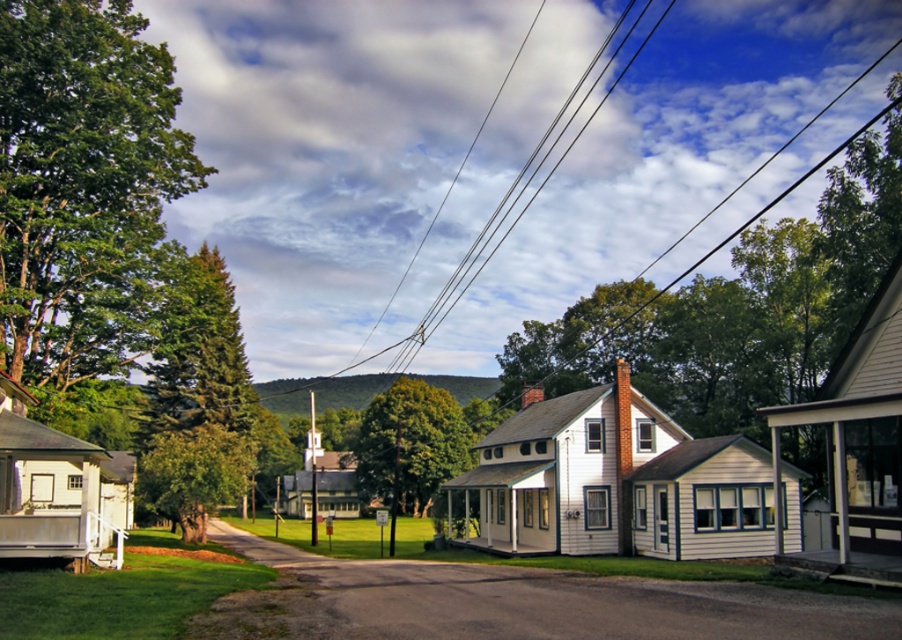
Is point (587, 109) positioned before point (227, 467)?

No, it is behind (227, 467).

Who is positioned more to the right, black wire at upper center or green leafy tree at center?

Positioned to the right is black wire at upper center.

Is point (656, 12) farther from camera compared to point (141, 493)?

Yes.

Identify the location of black wire at upper center. The width and height of the screenshot is (902, 640). (526, 179).

Does green leafy tree at left have a greater height compared to smooth asphalt driveway at center?

Yes.

Looking at this image, does green leafy tree at left appear over smooth asphalt driveway at center?

Correct, green leafy tree at left is located above smooth asphalt driveway at center.

Is point (98, 300) positioned behind point (219, 625)?

Yes, it is behind point (219, 625).

In order to click on green leafy tree at left in this screenshot , I will do `click(83, 188)`.

Is point (319, 557) farther from viewer compared to point (183, 448)?

No, (319, 557) is closer to viewer.

You are a GUI agent. You are given a task and a screenshot of the screen. Output one action in this format:
    pyautogui.click(x=<x>, y=<y>)
    Task: Click on the smooth asphalt driveway at center
    
    Given the screenshot: What is the action you would take?
    pyautogui.click(x=521, y=602)